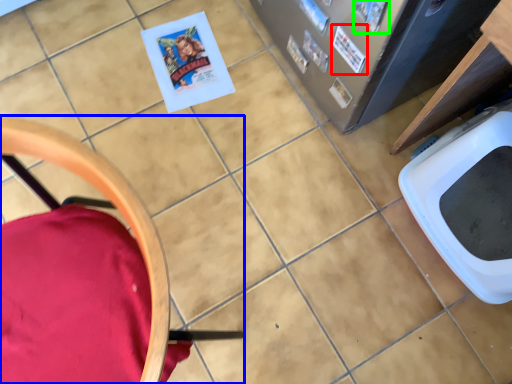
Question: Considering the real-world distances, which object is farthest from comic book (highlighted by a red box)? chair (highlighted by a blue box) or comic book (highlighted by a green box)?

Choices:
 (A) chair
 (B) comic book

Answer: (A)